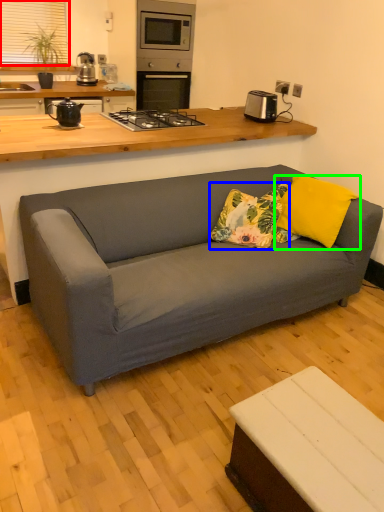
Question: Which object is positioned farthest from window screen (highlighted by a red box)? Select from throw pillow (highlighted by a blue box) and pillow (highlighted by a green box).

Choices:
 (A) throw pillow
 (B) pillow

Answer: (B)